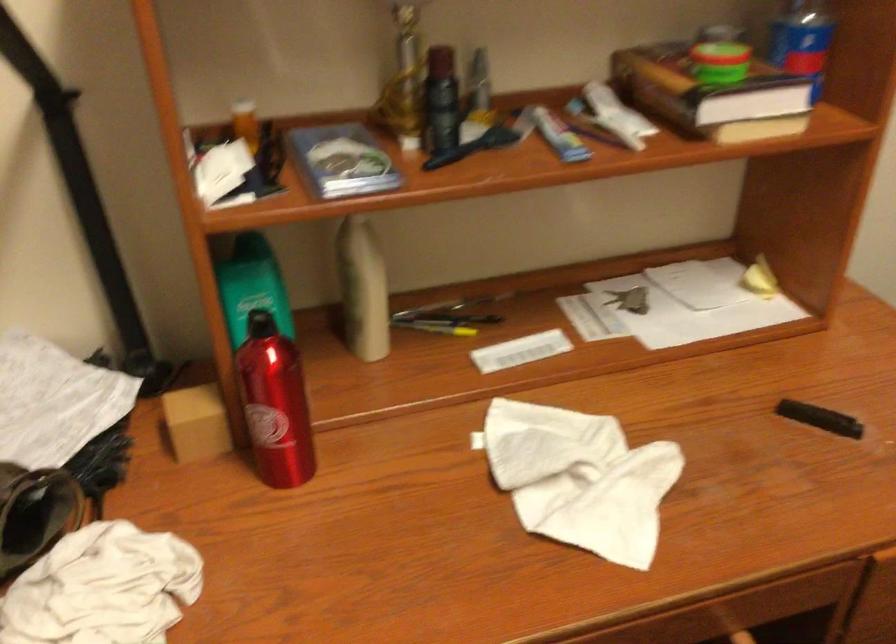
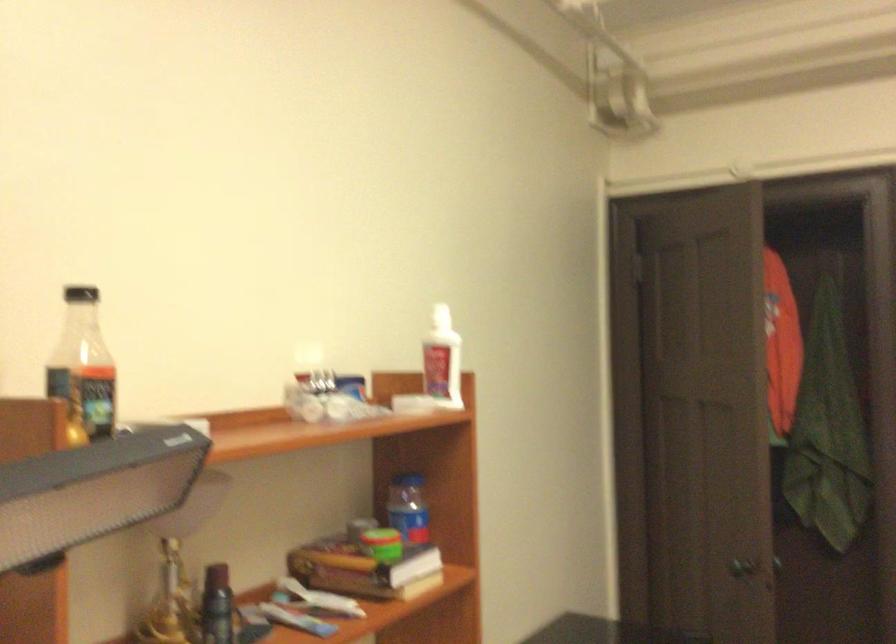
The images are taken continuously from a first-person perspective. In which direction is your viewpoint rotating?

The rotation direction of the camera is right-up.